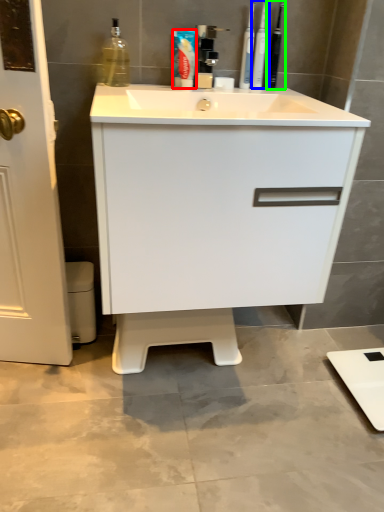
Question: Considering the real-world distances, which object is farthest from toothpaste (highlighted by a red box)? toiletry (highlighted by a blue box) or toiletry (highlighted by a green box)?

Choices:
 (A) toiletry
 (B) toiletry

Answer: (B)